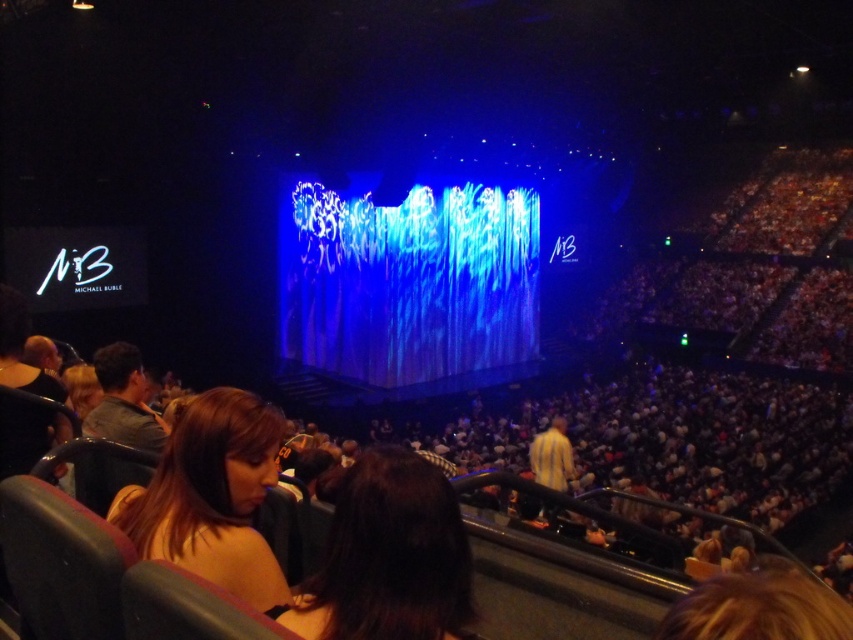
Does brown hair at center have a lesser height compared to gray fabric jacket at left?

Indeed, brown hair at center has a lesser height compared to gray fabric jacket at left.

What do you see at coordinates (387, 557) in the screenshot? I see `brown hair at center` at bounding box center [387, 557].

You are a GUI agent. You are given a task and a screenshot of the screen. Output one action in this format:
    pyautogui.click(x=<x>, y=<y>)
    Task: Click on the brown hair at center
    The height and width of the screenshot is (640, 853).
    Given the screenshot: What is the action you would take?
    pyautogui.click(x=387, y=557)

The width and height of the screenshot is (853, 640). In order to click on brown hair at center in this screenshot , I will do pyautogui.click(x=387, y=557).

Does point (250, 401) lie behind point (125, 371)?

No.

Is point (265, 556) farther from viewer compared to point (94, 368)?

That is False.

The height and width of the screenshot is (640, 853). In order to click on brown hair at lower left in this screenshot , I will do `click(212, 497)`.

Does brown hair at center lie in front of brown hair at lower left?

Yes, brown hair at center is closer to the viewer.

Does point (416, 605) come farther from viewer compared to point (276, 451)?

No, it is in front of (276, 451).

Where is `brown hair at center`? The width and height of the screenshot is (853, 640). brown hair at center is located at coordinates (387, 557).